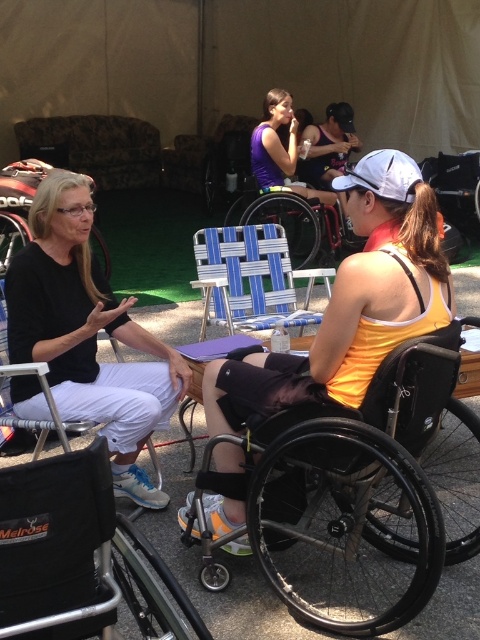
Question: Among these points, which one is farthest from the camera?

Choices:
 (A) (261, 301)
 (B) (358, 257)

Answer: (A)

Question: Observing the image, what is the correct spatial positioning of yellow fabric tank top at center in reference to blue woven plastic beach chair at center?

Choices:
 (A) left
 (B) right

Answer: (B)

Question: Observing the image, what is the correct spatial positioning of yellow fabric tank top at center in reference to purple matte tank top at center?

Choices:
 (A) right
 (B) left

Answer: (B)

Question: Among these points, which one is farthest from the camera?

Choices:
 (A) (242, 268)
 (B) (291, 157)
 (C) (392, 285)

Answer: (B)

Question: Is black plastic wheelchair at lower right to the left of blue woven plastic beach chair at center from the viewer's perspective?

Choices:
 (A) yes
 (B) no

Answer: (B)

Question: Which object appears closest to the camera in this image?

Choices:
 (A) matte black shirt at left
 (B) blue woven plastic beach chair at center
 (C) yellow fabric tank top at center
 (D) black plastic wheelchair at lower right

Answer: (D)